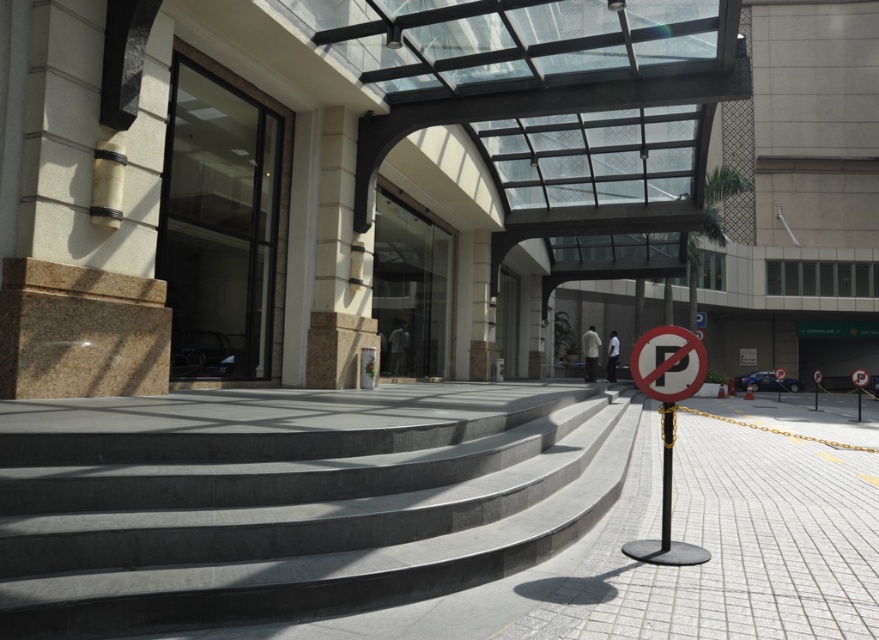
You are standing at the entrance of the building and want to take a photo of the point located at coordinate point (838, 636). If your camera has a maximum focus range of 3 meters, will it be able to focus on the point?

The point (838, 636) is 3.51 meters away from the camera. Since the camera can only focus up to 3 meters, it will not be able to focus on the point.

You are a delivery person with a cart that is 2 meters wide. You need to move from the gray concrete stairs at center to the white plastic sign at center. Can your cart fit through the space between them?

The distance between the gray concrete stairs at center and the white plastic sign at center is 3.28 meters. Since your cart is 2 meters wide, it can easily fit through the space as 3.28 meters is wider than 2 meters.

You are a delivery person trying to park your bike. You see the white tile pavement at center and the white plastic sign at center. Which surface can accommodate your bike better?

The white tile pavement at center is larger in size than the white plastic sign at center, so it can accommodate the bike better.